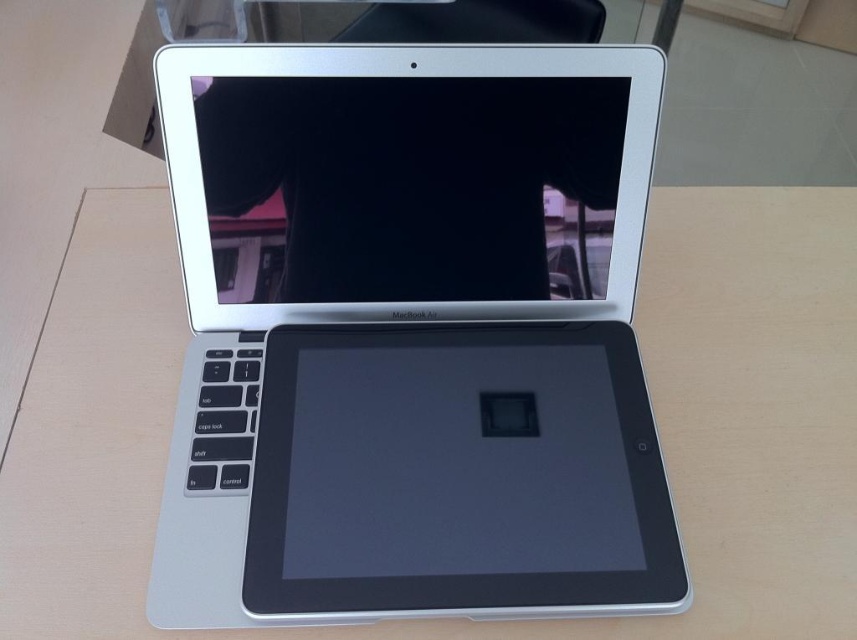
Is silver metallic laptop at center above slate matte tablet at center?

Yes.

Is silver metallic laptop at center to the left of slate matte tablet at center from the viewer's perspective?

Yes, silver metallic laptop at center is to the left of slate matte tablet at center.

Is point (494, 580) positioned in front of point (436, 380)?

Yes, it is in front of point (436, 380).

Locate an element on the screen. silver metallic laptop at center is located at coordinates (409, 336).

Does point (363, 253) lie in front of point (628, 490)?

No.

Identify the location of silver metallic tablet at center. (402, 177).

You are a GUI agent. You are given a task and a screenshot of the screen. Output one action in this format:
    pyautogui.click(x=<x>, y=<y>)
    Task: Click on the silver metallic laptop at center
    The width and height of the screenshot is (857, 640).
    Given the screenshot: What is the action you would take?
    pyautogui.click(x=409, y=336)

Does silver metallic laptop at center appear on the right side of silver metallic tablet at center?

Indeed, silver metallic laptop at center is positioned on the right side of silver metallic tablet at center.

This screenshot has width=857, height=640. I want to click on silver metallic laptop at center, so click(x=409, y=336).

At what (x,y) coordinates should I click in order to perform the action: click on silver metallic laptop at center. Please return your answer as a coordinate pair (x, y). The width and height of the screenshot is (857, 640). Looking at the image, I should click on (409, 336).